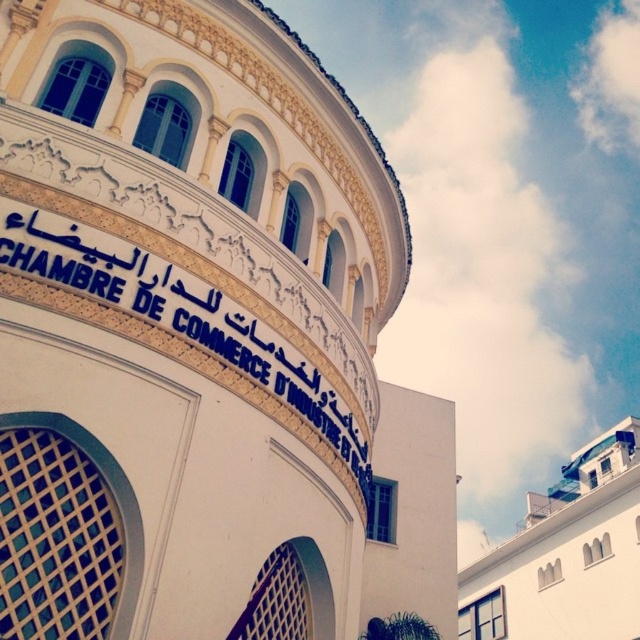
You are standing in front of the building and want to locate the point marked at coordinates (566, 554). Based on the scene description, where would this point be located?

The point marked at coordinates (566, 554) is located at the white matte building at upper right.

Based on the scene description, what is the significance of the point labeled as point (202, 339)?

The point labeled as point (202, 339) represents the white stone building at center.